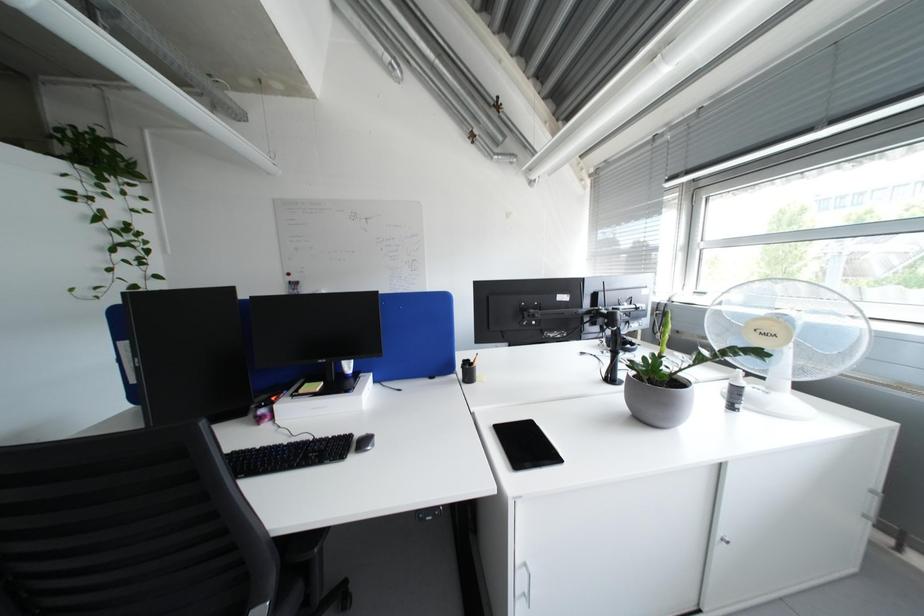
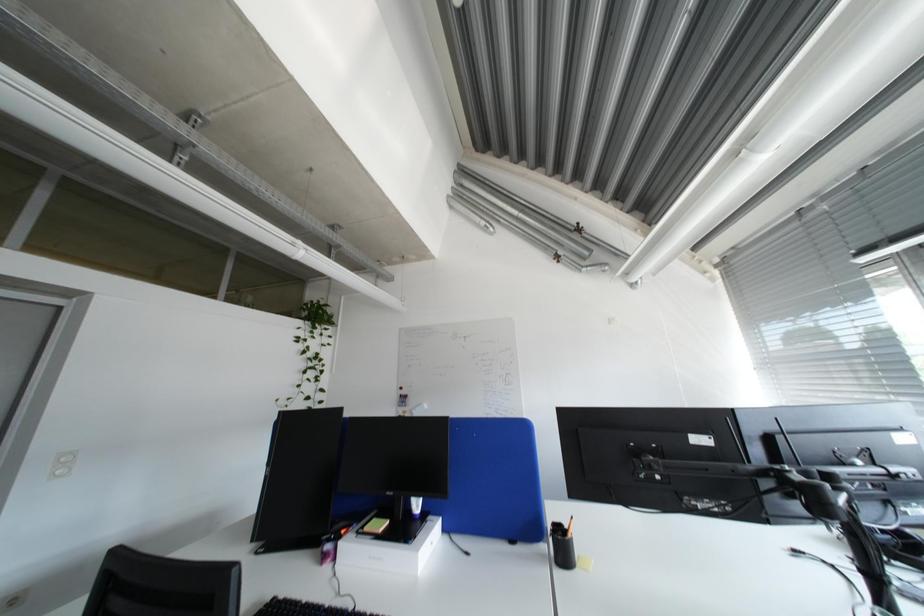
Based on the continuous images, in which direction is the camera rotating?

The rotation direction of the camera is left-up.